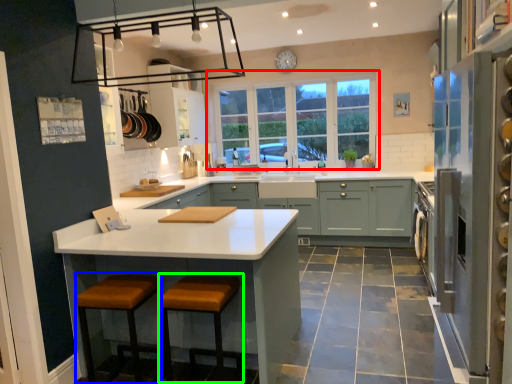
Question: Which is nearer to the window (highlighted by a red box)? step stool (highlighted by a blue box) or step stool (highlighted by a green box).

Choices:
 (A) step stool
 (B) step stool

Answer: (B)